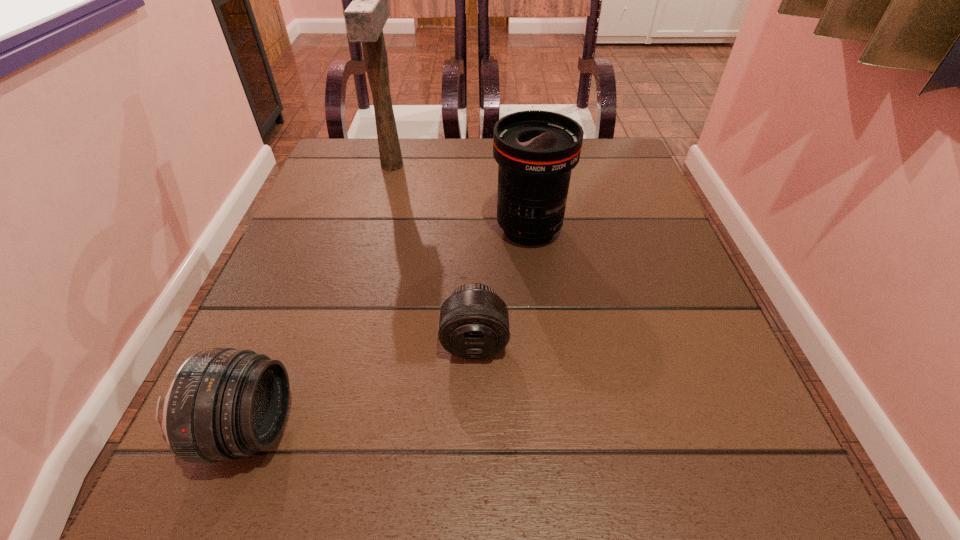
Locate an element on the screen. This screenshot has width=960, height=540. vacant space that's between the leftmost object and the shortest object is located at coordinates (362, 386).

This screenshot has height=540, width=960. I want to click on free spot between the second object from left to right and the farthest telephoto lens, so click(x=461, y=197).

Where is `empty space that is in between the third farthest object and the mallet`? This screenshot has height=540, width=960. empty space that is in between the third farthest object and the mallet is located at coordinates (433, 254).

Select which object is the closest to the second nearest object. Please provide its 2D coordinates. Your answer should be formatted as a tuple, i.e. [(x, y)], where the tuple contains the x and y coordinates of a point satisfying the conditions above.

[(536, 150)]

At what (x,y) coordinates should I click in order to perform the action: click on object that is the closest to the shortest telephoto lens. Please return your answer as a coordinate pair (x, y). Looking at the image, I should click on (536, 150).

Locate which telephoto lens ranks second in proximity to the third farthest object. Please provide its 2D coordinates. Your answer should be formatted as a tuple, i.e. [(x, y)], where the tuple contains the x and y coordinates of a point satisfying the conditions above.

[(223, 403)]

The image size is (960, 540). Identify the location of telephoto lens that stands as the closest to the second farthest object. (474, 321).

Find the location of `vacant area that satisfies the following two spatial constraints: 1. on the front side of the tallest object; 2. at the front element of the second shortest telephoto lens`. vacant area that satisfies the following two spatial constraints: 1. on the front side of the tallest object; 2. at the front element of the second shortest telephoto lens is located at coordinates 322,429.